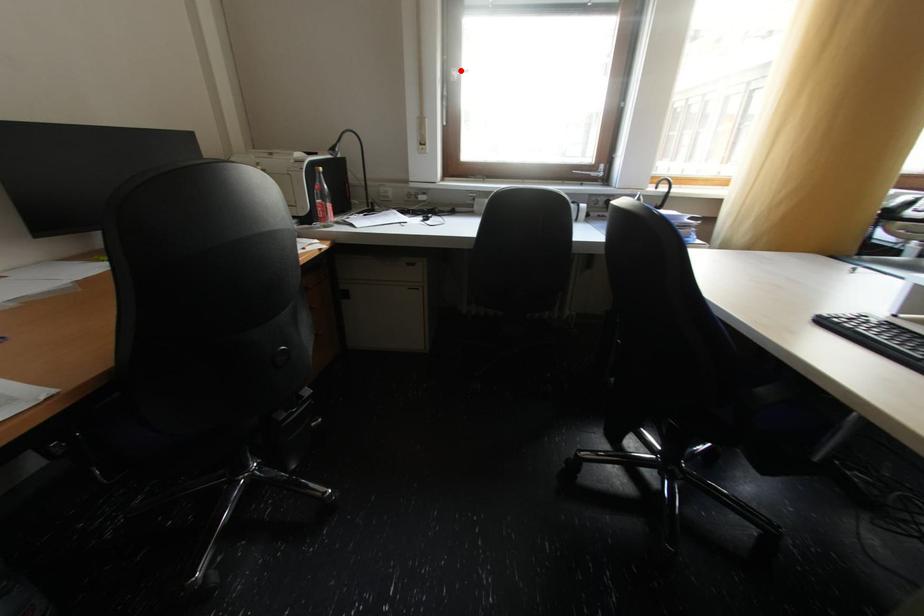
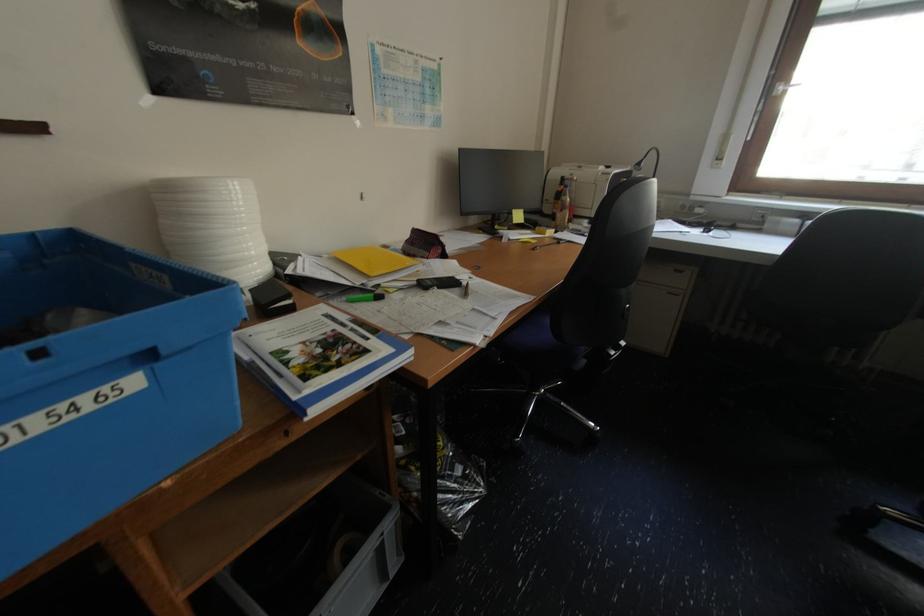
Where in the second image is the point corresponding to the highlighted location from the first image?

(786, 84)